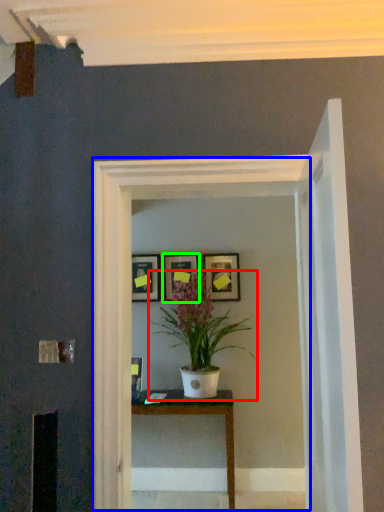
Question: Which object is positioned farthest from houseplant (highlighted by a red box)? Select from glass door (highlighted by a blue box) and picture frame (highlighted by a green box).

Choices:
 (A) glass door
 (B) picture frame

Answer: (A)